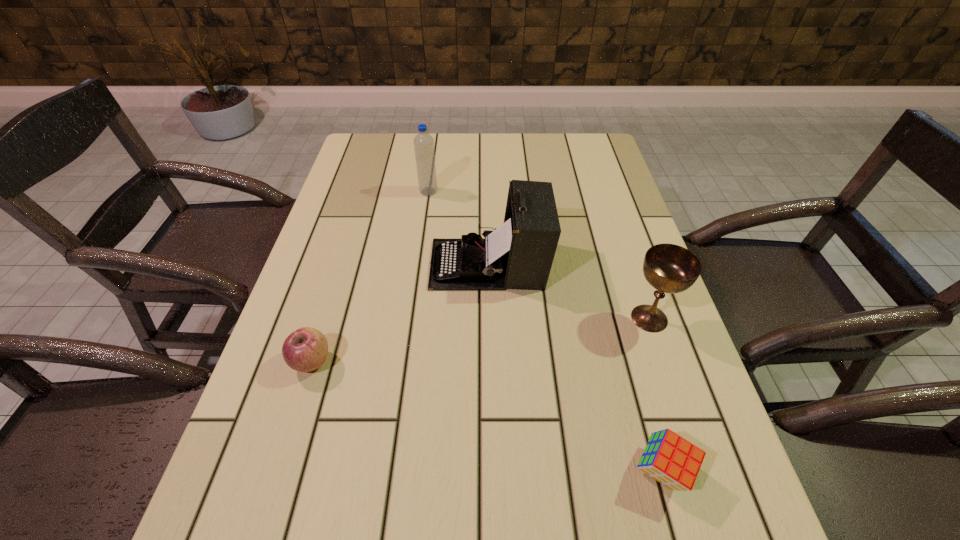
You are a GUI agent. You are given a task and a screenshot of the screen. Output one action in this format:
    pyautogui.click(x=<x>, y=<y>)
    Task: Click on the farthest object
    Image resolution: width=960 pixels, height=540 pixels.
    Given the screenshot: What is the action you would take?
    pyautogui.click(x=423, y=142)

This screenshot has width=960, height=540. I want to click on typewriter, so click(519, 254).

Where is `chalice`? The height and width of the screenshot is (540, 960). chalice is located at coordinates (669, 268).

At what (x,y) coordinates should I click in order to perform the action: click on the third nearest object. Please return your answer as a coordinate pair (x, y). The height and width of the screenshot is (540, 960). Looking at the image, I should click on (669, 268).

Where is `apple`? This screenshot has width=960, height=540. apple is located at coordinates (306, 349).

I want to click on the second nearest object, so click(x=306, y=349).

This screenshot has width=960, height=540. Identify the location of the nearest object. (668, 458).

Locate an element on the screen. The width and height of the screenshot is (960, 540). vacant space located on the left of the water bottle is located at coordinates (381, 192).

This screenshot has height=540, width=960. In order to click on vacant space located inside the open case of the second farthest object in this screenshot , I will do `click(376, 264)`.

Find the location of a particular element. The width and height of the screenshot is (960, 540). blank space located 0.050m inside the open case of the second farthest object is located at coordinates (409, 264).